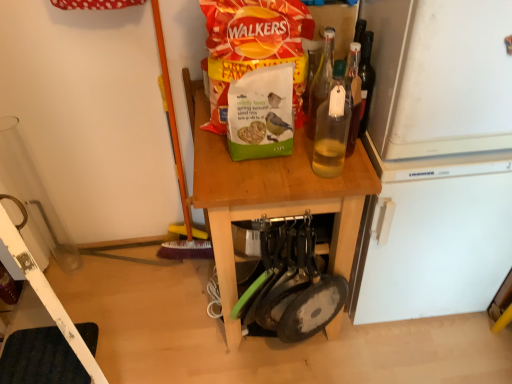
I want to click on vacant area that is in front of green matte birdseed packet at center, so click(x=260, y=176).